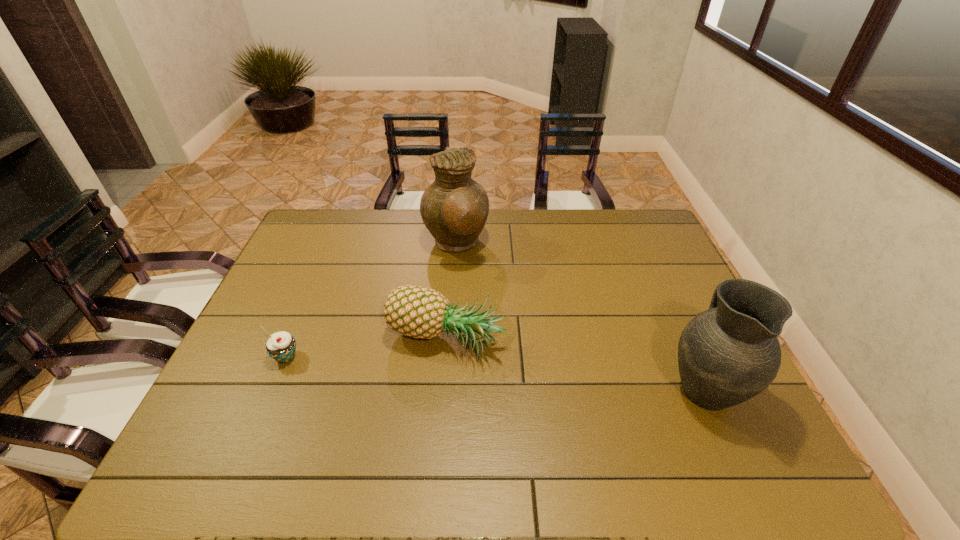
Where is `vacant space situated 0.290m on the side of the right pitcher with the handle`? vacant space situated 0.290m on the side of the right pitcher with the handle is located at coordinates (656, 280).

Where is `vacant area situated on the back of the second shortest object`? vacant area situated on the back of the second shortest object is located at coordinates (451, 267).

Find the location of a particular element. This screenshot has width=960, height=540. vacant region located on the back of the leftmost object is located at coordinates (307, 306).

The image size is (960, 540). In order to click on object situated at the far edge in this screenshot , I will do `click(454, 208)`.

Locate an element on the screen. This screenshot has height=540, width=960. object at the left edge is located at coordinates (281, 346).

The width and height of the screenshot is (960, 540). I want to click on object that is at the right edge, so click(728, 354).

In the image, there is a desktop. Identify the location of vacant region at the far edge. Image resolution: width=960 pixels, height=540 pixels. (397, 210).

The image size is (960, 540). In order to click on vacant point at the left edge in this screenshot , I will do `click(280, 278)`.

Image resolution: width=960 pixels, height=540 pixels. In order to click on vacant space at the right edge of the desktop in this screenshot , I will do `click(659, 272)`.

At what (x,y) coordinates should I click in order to perform the action: click on free spot at the far left corner of the desktop. Please return your answer as a coordinate pair (x, y). This screenshot has width=960, height=540. Looking at the image, I should click on (303, 226).